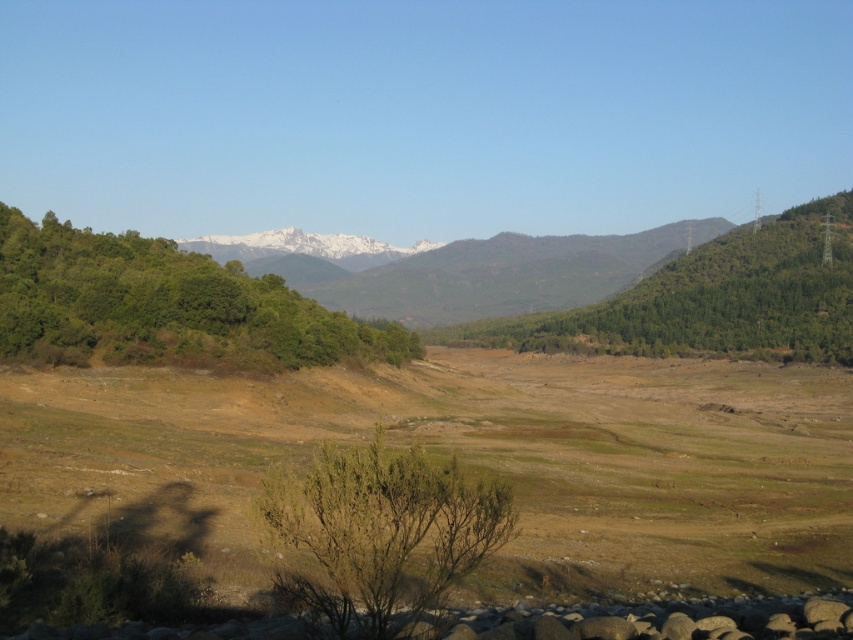
Question: Does green leafy tree at left have a larger size compared to green leafy tree at center-right?

Choices:
 (A) no
 (B) yes

Answer: (A)

Question: Which point is closer to the camera?

Choices:
 (A) green leafy tree at left
 (B) green leafy bush at center

Answer: (B)

Question: Can you confirm if green leafy tree at left is smaller than green leafy tree at center-right?

Choices:
 (A) yes
 (B) no

Answer: (A)

Question: Among these objects, which one is farthest from the camera?

Choices:
 (A) green leafy tree at center-right
 (B) green leafy bush at center
 (C) green leafy tree at left

Answer: (A)

Question: Does brown grassland at center come in front of green leafy bush at center?

Choices:
 (A) yes
 (B) no

Answer: (B)

Question: Which of the following is the farthest from the observer?

Choices:
 (A) (334, 483)
 (B) (354, 381)
 (C) (1, 355)

Answer: (B)